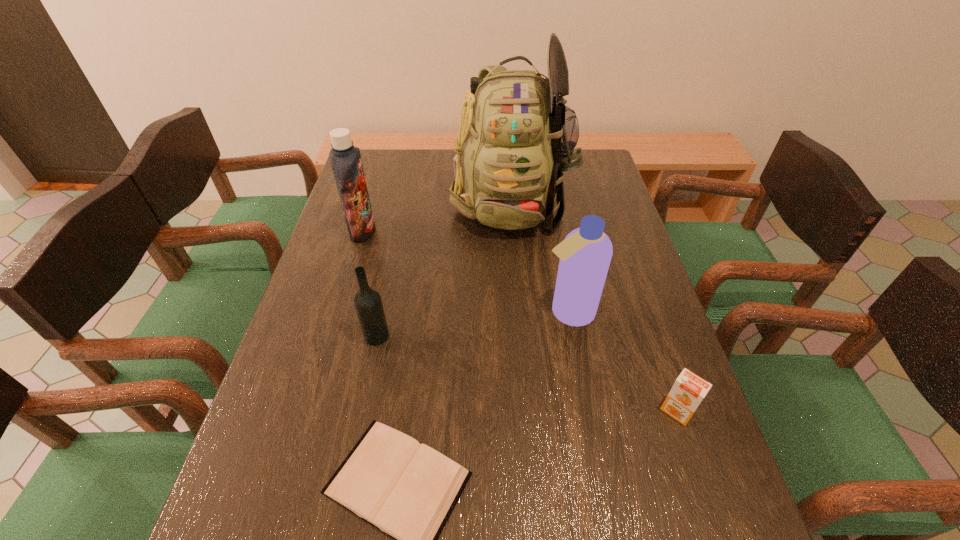
At what (x,y) coordinates should I click in order to perform the action: click on free space at the right edge of the desktop. Please return your answer as a coordinate pair (x, y). This screenshot has width=960, height=540. Looking at the image, I should click on (671, 504).

At what (x,y) coordinates should I click in order to perform the action: click on vacant space at the far left corner of the desktop. Please return your answer as a coordinate pair (x, y). The width and height of the screenshot is (960, 540). Looking at the image, I should click on (366, 159).

The width and height of the screenshot is (960, 540). Find the location of `free spot between the third shortest object and the second shortest object`. free spot between the third shortest object and the second shortest object is located at coordinates 527,374.

Locate an element on the screen. The width and height of the screenshot is (960, 540). vacant space that's between the left shampoo and the orange juice is located at coordinates (519, 321).

Where is `vacant space that's between the tallest object and the fourth tallest object`? This screenshot has height=540, width=960. vacant space that's between the tallest object and the fourth tallest object is located at coordinates [444, 268].

Locate an element on the screen. vacant area that lies between the fourth tallest object and the backpack is located at coordinates (444, 268).

You are a GUI agent. You are given a task and a screenshot of the screen. Output one action in this format:
    pyautogui.click(x=<x>, y=<y>)
    Task: Click on the vacant region between the farther shampoo and the third shortest object
    This screenshot has height=540, width=960.
    Given the screenshot: What is the action you would take?
    pyautogui.click(x=370, y=283)

You are a GUI agent. You are given a task and a screenshot of the screen. Output one action in this format:
    pyautogui.click(x=<x>, y=<y>)
    Task: Click on the vacant area between the vodka and the second shortest object
    The width and height of the screenshot is (960, 540).
    Given the screenshot: What is the action you would take?
    pyautogui.click(x=527, y=374)

At what (x,y) coordinates should I click in order to perform the action: click on unoccupied area between the right shampoo and the third shortest object. Please return your answer as a coordinate pair (x, y). Image resolution: width=960 pixels, height=540 pixels. Looking at the image, I should click on click(472, 324).

Select which object is the third closest to the orange juice. Please provide its 2D coordinates. Your answer should be formatted as a tuple, i.e. [(x, y)], where the tuple contains the x and y coordinates of a point satisfying the conditions above.

[(516, 137)]